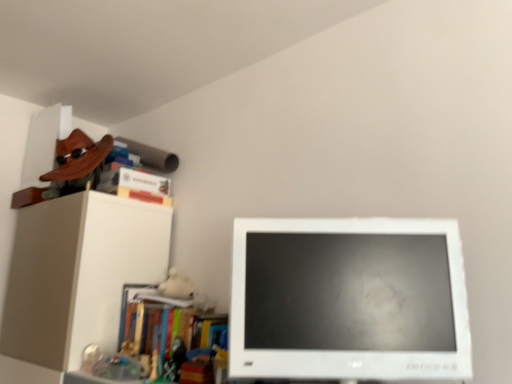
Question: Considering the relative positions of wooden skateboard at upper left, the fourth book when ordered from bottom to top, and multicolored plastic books at left, marked as the fourth book in a top-to-bottom arrangement, in the image provided, is wooden skateboard at upper left, the fourth book when ordered from bottom to top, behind multicolored plastic books at left, marked as the fourth book in a top-to-bottom arrangement,?

Choices:
 (A) no
 (B) yes

Answer: (B)

Question: Are wooden skateboard at upper left, marked as the 1th book in a top-to-bottom arrangement, and multicolored plastic books at left, the first book positioned from the bottom, far apart?

Choices:
 (A) no
 (B) yes

Answer: (A)

Question: Considering the relative positions of wooden skateboard at upper left, marked as the 1th book in a top-to-bottom arrangement, and multicolored plastic books at left, the first book positioned from the bottom, in the image provided, is wooden skateboard at upper left, marked as the 1th book in a top-to-bottom arrangement, to the left of multicolored plastic books at left, the first book positioned from the bottom, from the viewer's perspective?

Choices:
 (A) no
 (B) yes

Answer: (B)

Question: From the image's perspective, is wooden skateboard at upper left, marked as the 1th book in a top-to-bottom arrangement, below multicolored plastic books at left, marked as the fourth book in a top-to-bottom arrangement?

Choices:
 (A) yes
 (B) no

Answer: (B)

Question: From a real-world perspective, does wooden skateboard at upper left, marked as the 1th book in a top-to-bottom arrangement, sit lower than multicolored plastic books at left, the first book positioned from the bottom?

Choices:
 (A) yes
 (B) no

Answer: (B)

Question: From the image's perspective, is wooden skateboard at upper left, marked as the 1th book in a top-to-bottom arrangement, on top of multicolored plastic books at left, marked as the fourth book in a top-to-bottom arrangement?

Choices:
 (A) yes
 (B) no

Answer: (A)

Question: Does hardcover book at upper left, the second book positioned from the bottom, have a larger size compared to white glossy computer monitor at center?

Choices:
 (A) yes
 (B) no

Answer: (B)

Question: Is hardcover book at upper left, which is the 3th book from top to bottom, completely or partially outside of white glossy computer monitor at center?

Choices:
 (A) no
 (B) yes

Answer: (B)

Question: Is hardcover book at upper left, which is the 3th book from top to bottom, facing towards white glossy computer monitor at center?

Choices:
 (A) yes
 (B) no

Answer: (B)

Question: From a real-world perspective, does hardcover book at upper left, the second book positioned from the bottom, sit lower than white glossy computer monitor at center?

Choices:
 (A) yes
 (B) no

Answer: (B)

Question: Can you confirm if hardcover book at upper left, the second book positioned from the bottom, is shorter than white glossy computer monitor at center?

Choices:
 (A) yes
 (B) no

Answer: (A)

Question: From the image's perspective, is hardcover book at upper left, the second book positioned from the bottom, beneath white glossy computer monitor at center?

Choices:
 (A) no
 (B) yes

Answer: (A)

Question: Considering the relative sizes of wooden skateboard at upper left, the fourth book when ordered from bottom to top, and white glossy computer monitor at center in the image provided, is wooden skateboard at upper left, the fourth book when ordered from bottom to top, bigger than white glossy computer monitor at center?

Choices:
 (A) yes
 (B) no

Answer: (A)